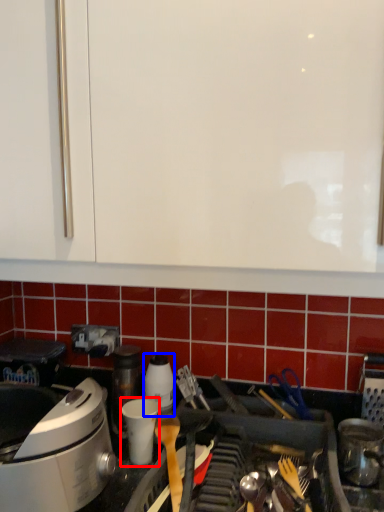
Question: Which object appears closest to the camera in this image, appliance (highlighted by a red box) or kitchen appliance (highlighted by a blue box)?

Choices:
 (A) appliance
 (B) kitchen appliance

Answer: (A)